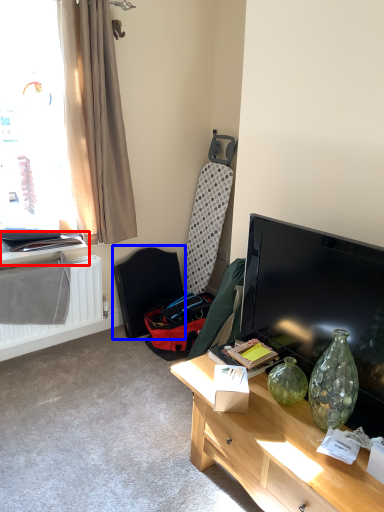
Question: Which point is further to the camera, window sill (highlighted by a red box) or swivel chair (highlighted by a blue box)?

Choices:
 (A) window sill
 (B) swivel chair

Answer: (B)